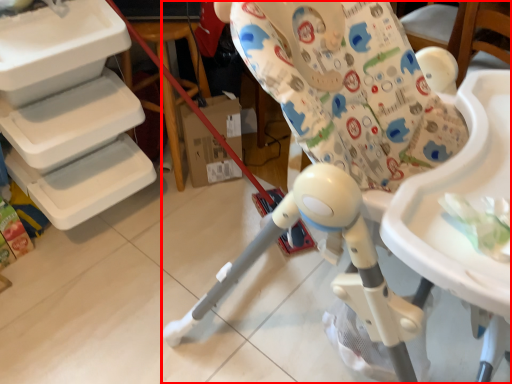
Question: Considering the relative positions of chair (annotated by the red box) and table in the image provided, where is chair (annotated by the red box) located with respect to the staircase?

Choices:
 (A) right
 (B) left

Answer: (A)